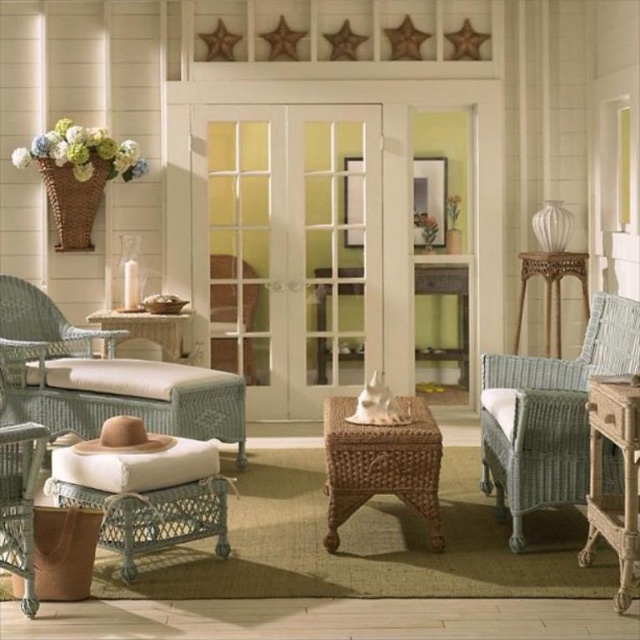
Question: Is woven light blue armchair at right smaller than white wicker stool at lower left?

Choices:
 (A) no
 (B) yes

Answer: (A)

Question: Which of the following is the closest to the observer?

Choices:
 (A) rattan stool at center
 (B) woven light blue armchair at right
 (C) woven wicker armchair at center
 (D) white wicker stool at lower left

Answer: (D)

Question: Among these objects, which one is nearest to the camera?

Choices:
 (A) woven wicker armchair at center
 (B) rattan stool at center

Answer: (B)

Question: Is woven light blue armchair at right bigger than white wicker stool at lower left?

Choices:
 (A) yes
 (B) no

Answer: (A)

Question: Is rattan stool at center positioned in front of woven wicker armchair at center?

Choices:
 (A) no
 (B) yes

Answer: (B)

Question: Among these objects, which one is farthest from the camera?

Choices:
 (A) white wicker stool at lower left
 (B) woven wicker armchair at center

Answer: (B)